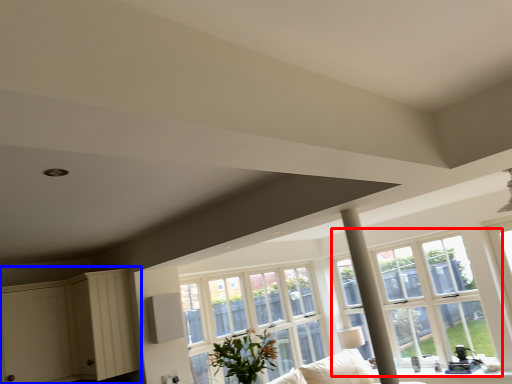
Question: Which point is closer to the camera, window (highlighted by a red box) or dresser (highlighted by a blue box)?

Choices:
 (A) window
 (B) dresser

Answer: (B)